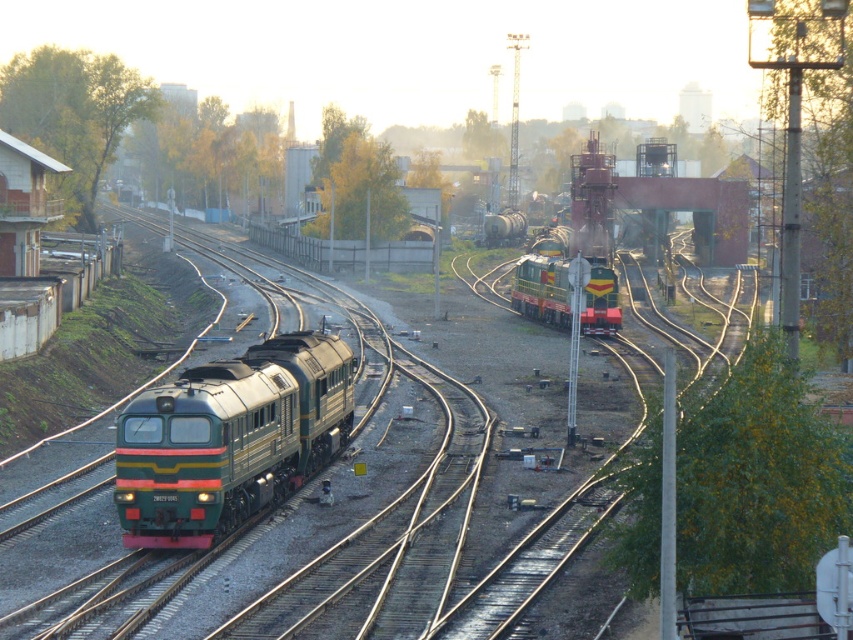
What do you see at coordinates (303, 483) in the screenshot? I see `green metallic train at left` at bounding box center [303, 483].

Who is positioned more to the right, green metallic train at left or green matte train at left?

green matte train at left is more to the right.

Is point (612, 435) less distant than point (213, 448)?

No.

This screenshot has width=853, height=640. What are the coordinates of `green metallic train at left` in the screenshot? It's located at coord(303,483).

You are a GUI agent. You are given a task and a screenshot of the screen. Output one action in this format:
    pyautogui.click(x=<x>, y=<y>)
    Task: Click on the green metallic train at left
    
    Given the screenshot: What is the action you would take?
    pyautogui.click(x=303, y=483)

How far apart are green metallic train at left and green metallic locomotive at center?

They are 15.19 meters apart.

Where is `green metallic train at left`? The image size is (853, 640). green metallic train at left is located at coordinates [303, 483].

Does green matte train at left have a lesser height compared to green metallic locomotive at center?

Yes, green matte train at left is shorter than green metallic locomotive at center.

Can you confirm if green matte train at left is bigger than green metallic locomotive at center?

Actually, green matte train at left might be smaller than green metallic locomotive at center.

Is point (292, 435) positioned before point (584, 324)?

Yes.

You are a GUI agent. You are given a task and a screenshot of the screen. Output one action in this format:
    pyautogui.click(x=<x>, y=<y>)
    Task: Click on the green matte train at left
    The width and height of the screenshot is (853, 640).
    Given the screenshot: What is the action you would take?
    pyautogui.click(x=229, y=438)